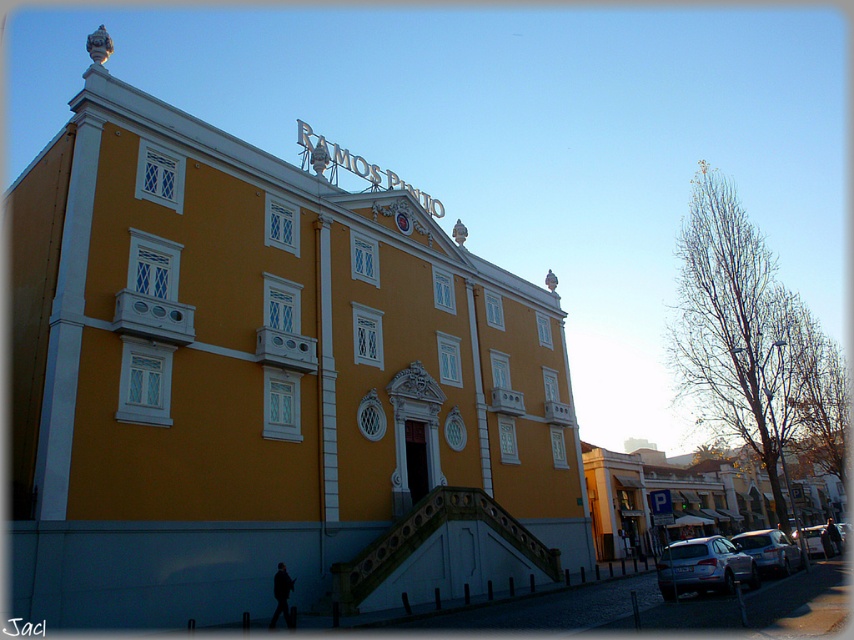
Question: Does yellow matte building at center appear over satin silver suv at lower right?

Choices:
 (A) no
 (B) yes

Answer: (B)

Question: Estimate the real-world distances between objects in this image. Which object is closer to the satin silver car at lower right?

Choices:
 (A) yellow matte building at center
 (B) satin silver suv at lower right
 (C) metallic silver car at lower right

Answer: (B)

Question: Which object appears farthest from the camera in this image?

Choices:
 (A) metallic silver car at lower right
 (B) satin silver car at lower right
 (C) satin silver suv at lower right
 (D) yellow matte building at center

Answer: (A)

Question: Is yellow matte building at center to the left of metallic silver car at lower right from the viewer's perspective?

Choices:
 (A) yes
 (B) no

Answer: (A)

Question: In this image, where is yellow matte building at center located relative to satin silver car at lower right?

Choices:
 (A) left
 (B) right

Answer: (A)

Question: Which object appears closest to the camera in this image?

Choices:
 (A) metallic silver car at lower right
 (B) yellow matte building at center
 (C) satin silver car at lower right

Answer: (B)